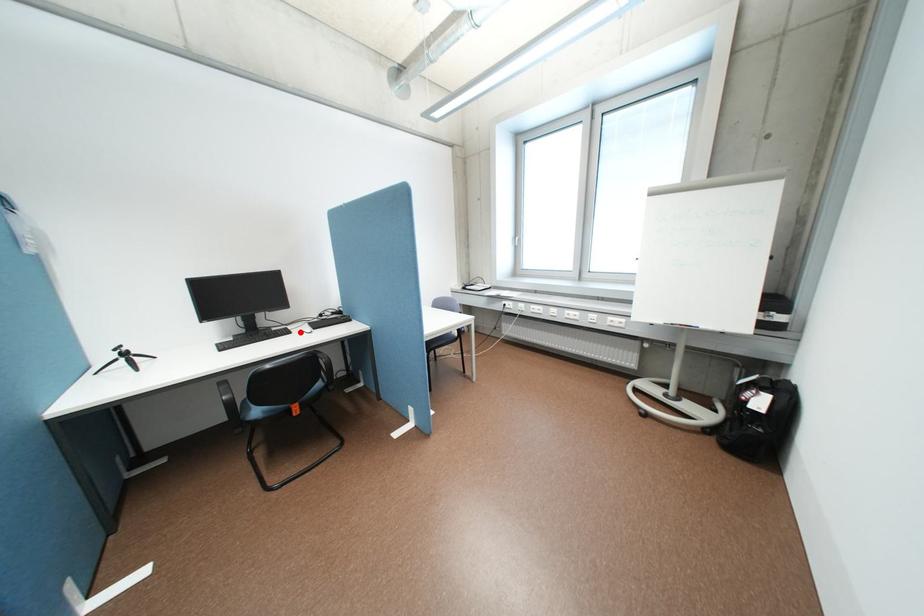
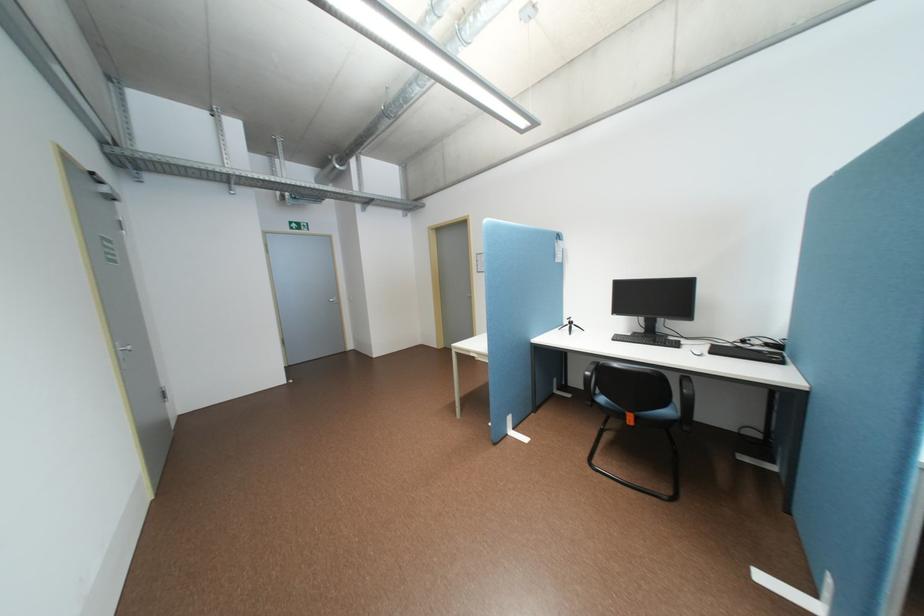
The point at the highlighted location is marked in the first image. Where is the corresponding point in the second image?

(688, 346)